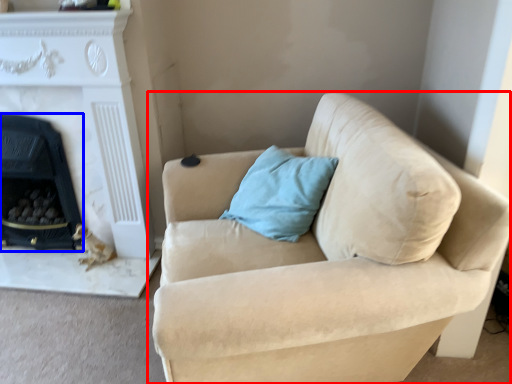
Question: Which point is further to the camera, studio couch (highlighted by a red box) or fireplace (highlighted by a blue box)?

Choices:
 (A) studio couch
 (B) fireplace

Answer: (B)